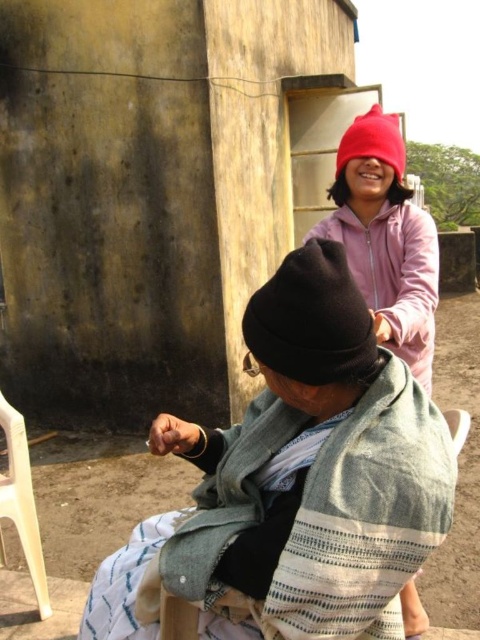
You are standing at point (347, 625) and want to walk to point (45, 400). Is there a clear path between these two points?

Point (45, 400) is behind point (347, 625), so there might be an obstruction blocking the path between them. You should check for any objects in between before proceeding.

In the scene shown: You are standing at the point with coordinates point (3, 397) and want to walk towards the point with coordinates point (199, 88). Will you be moving forward or backward relative to your current position?

Since point (199, 88) is in front of point (3, 397), you will be moving forward towards it.

You are a delivery robot with a package that needs to be placed between the smooth concrete wall at upper center and the black woolen hat at lower center. The package requires a space of 3 meters to fit. Can you place the package there?

The distance between the smooth concrete wall at upper center and the black woolen hat at lower center is 3.55 meters, which is more than enough to accommodate the 3 meter package. Yes, the package can be placed there.